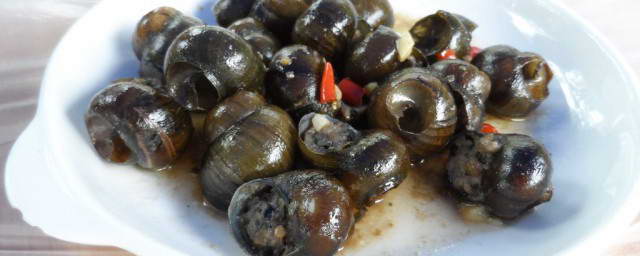
Where is `handle`? handle is located at coordinates pos(49,191).